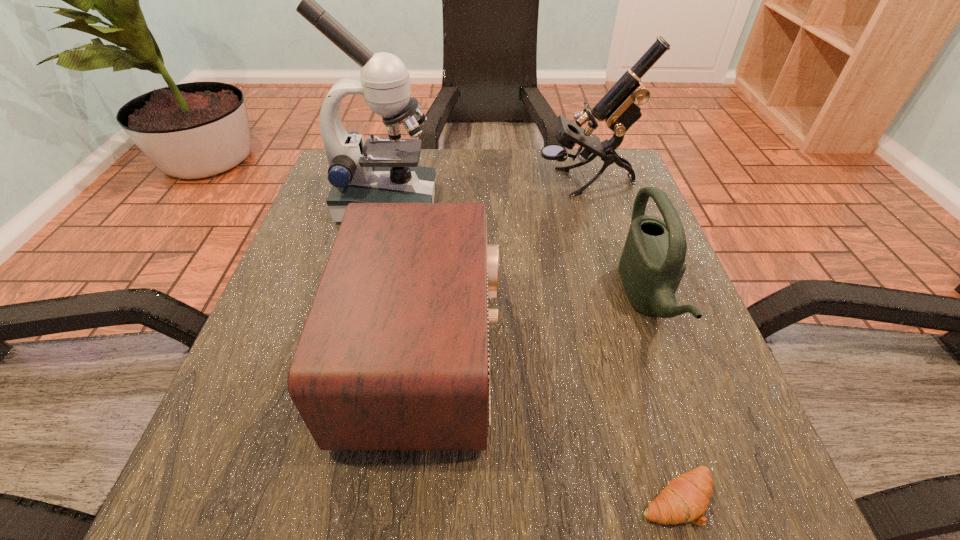
In order to click on free space located through the eyepiece of the fourth shortest object in this screenshot , I will do `click(509, 183)`.

At what (x,y) coordinates should I click in order to perform the action: click on vacant area situated 0.400m through the eyepiece of the fourth shortest object. Please return your answer as a coordinate pair (x, y). Image resolution: width=960 pixels, height=540 pixels. Looking at the image, I should click on (371, 183).

What are the coordinates of `vacant space located on the front panel of the radio receiver` in the screenshot? It's located at (566, 354).

Locate an element on the screen. vacant space located on the spout of the watering can is located at coordinates (458, 299).

Identify the location of free space located 0.210m on the spout of the watering can. This screenshot has width=960, height=540. (508, 299).

Find the location of a particular element. free space located on the spout of the watering can is located at coordinates (419, 299).

The image size is (960, 540). I want to click on free space located on the left of the nearest object, so click(x=487, y=498).

Find the location of a particular element. radio receiver positioned at the near edge is located at coordinates (394, 355).

At what (x,y) coordinates should I click in order to perform the action: click on crescent roll that is at the near edge. Please return your answer as a coordinate pair (x, y). Looking at the image, I should click on (685, 499).

Where is `object located at the left edge`? The width and height of the screenshot is (960, 540). object located at the left edge is located at coordinates (383, 170).